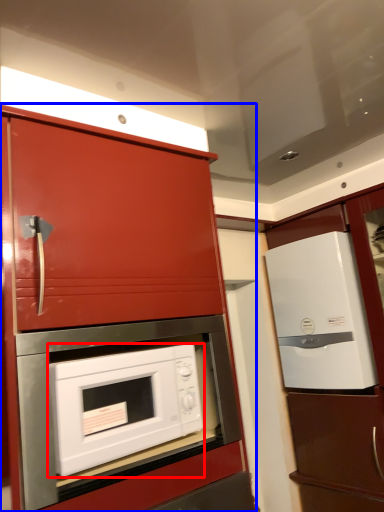
Question: Which of the following is the farthest to the observer, microwave oven (highlighted by a red box) or cabinetry (highlighted by a blue box)?

Choices:
 (A) microwave oven
 (B) cabinetry

Answer: (A)